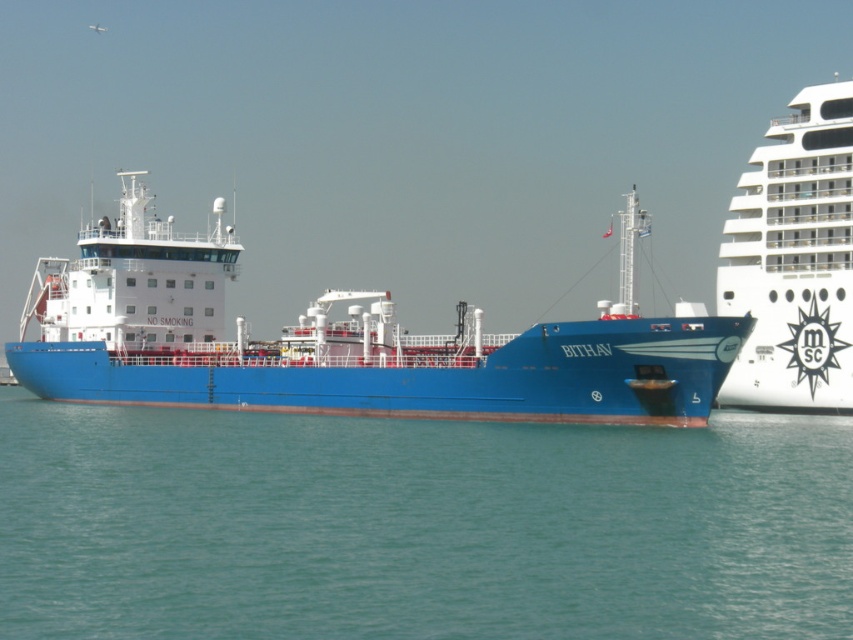
Who is taller, teal water at center or blue matte ship at center?

blue matte ship at center is taller.

Which is in front, point (833, 493) or point (65, 358)?

Point (833, 493)

Is point (369, 422) positioned after point (126, 355)?

No, (369, 422) is closer to viewer.

I want to click on teal water at center, so click(x=418, y=525).